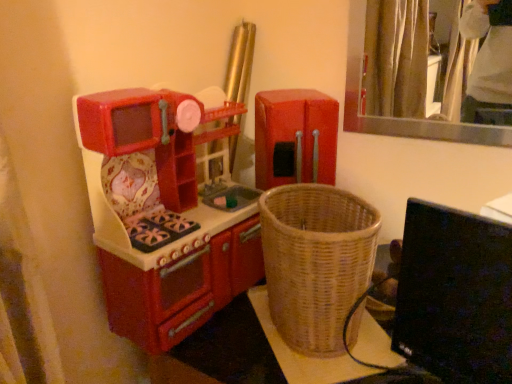
Question: Looking at their shapes, would you say matte plastic toy kitchen at left, which ranks as the second appliance in right-to-left order, is wider or thinner than red plastic refrigerator at center, which ranks as the 1th appliance in right-to-left order?

Choices:
 (A) thin
 (B) wide

Answer: (B)

Question: Considering the positions of matte plastic toy kitchen at left, which ranks as the second appliance in right-to-left order, and red plastic refrigerator at center, the second appliance in the left-to-right sequence, in the image, is matte plastic toy kitchen at left, which ranks as the second appliance in right-to-left order, taller or shorter than red plastic refrigerator at center, the second appliance in the left-to-right sequence,?

Choices:
 (A) tall
 (B) short

Answer: (A)

Question: Which is nearer to the woven wicker basket at lower right?

Choices:
 (A) matte plastic toy kitchen at left, the first appliance when ordered from left to right
 (B) red plastic refrigerator at center, which ranks as the 1th appliance in right-to-left order
 (C) woven brown basket at center
 (D) black glossy computer monitor at lower right

Answer: (C)

Question: Estimate the real-world distances between objects in this image. Which object is farther from the woven brown basket at center?

Choices:
 (A) black glossy computer monitor at lower right
 (B) red plastic refrigerator at center, the second appliance in the left-to-right sequence
 (C) woven wicker basket at lower right
 (D) matte plastic toy kitchen at left, which ranks as the second appliance in right-to-left order

Answer: (B)